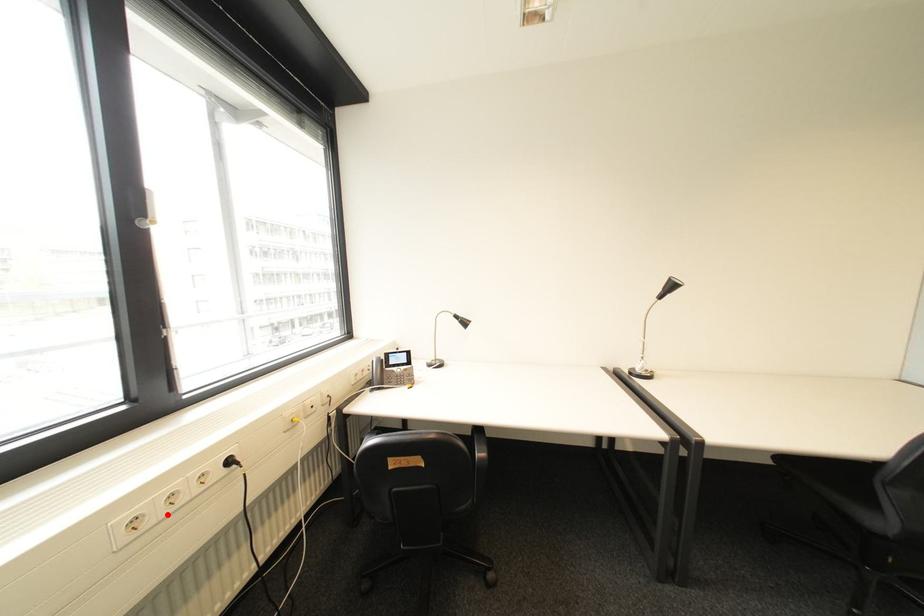
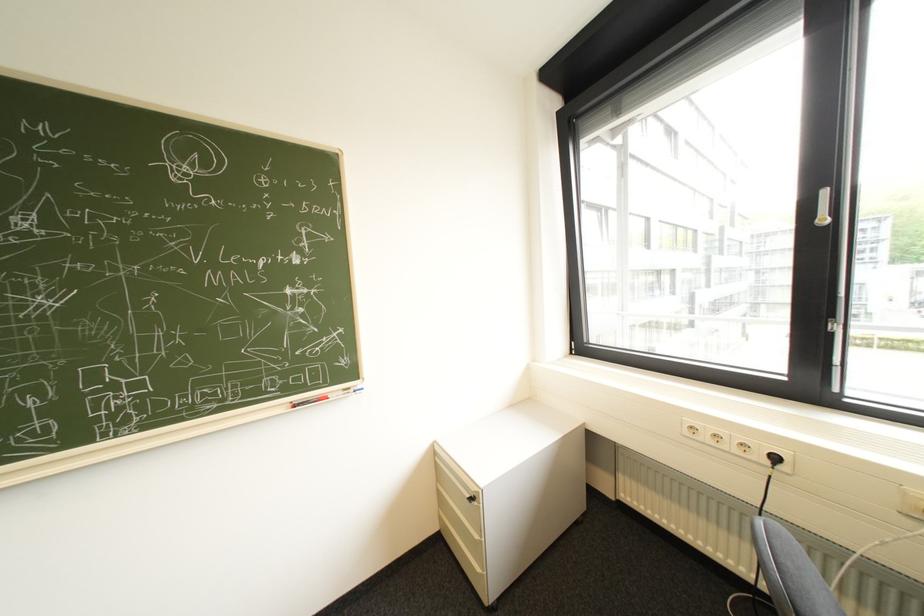
Find the pixel in the second image that matches the highlighted location in the first image.

(715, 438)